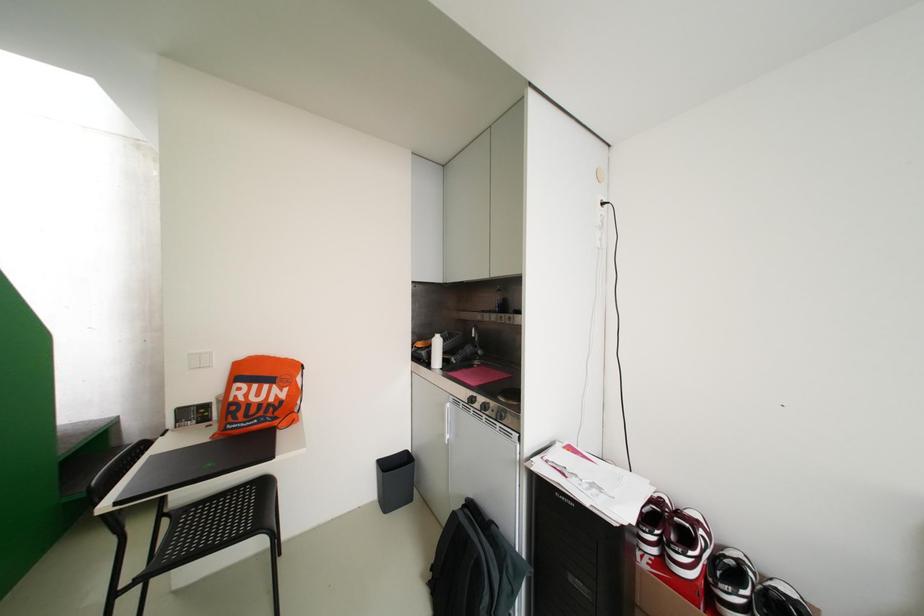
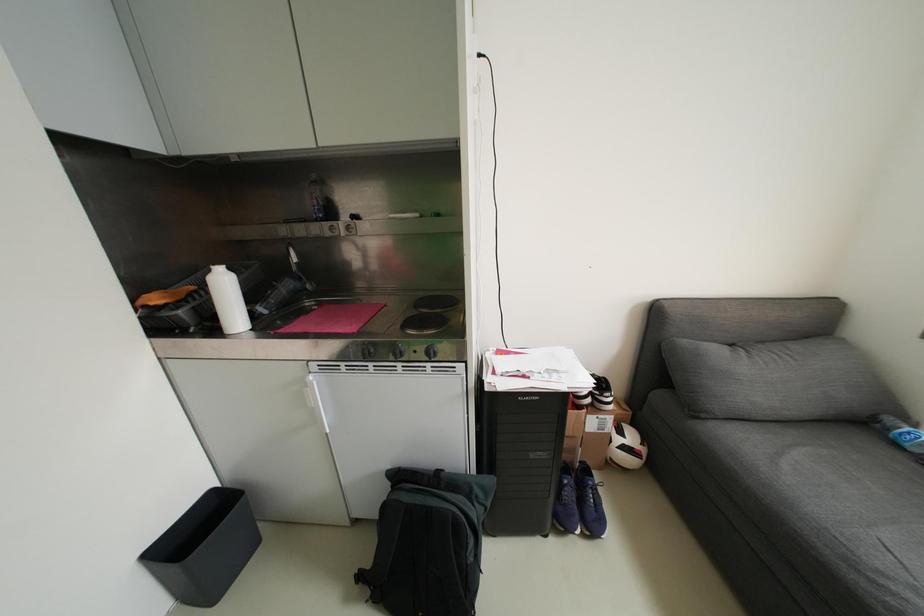
Consider the image. How did the camera likely rotate?

The rotation direction of the camera is right-down.